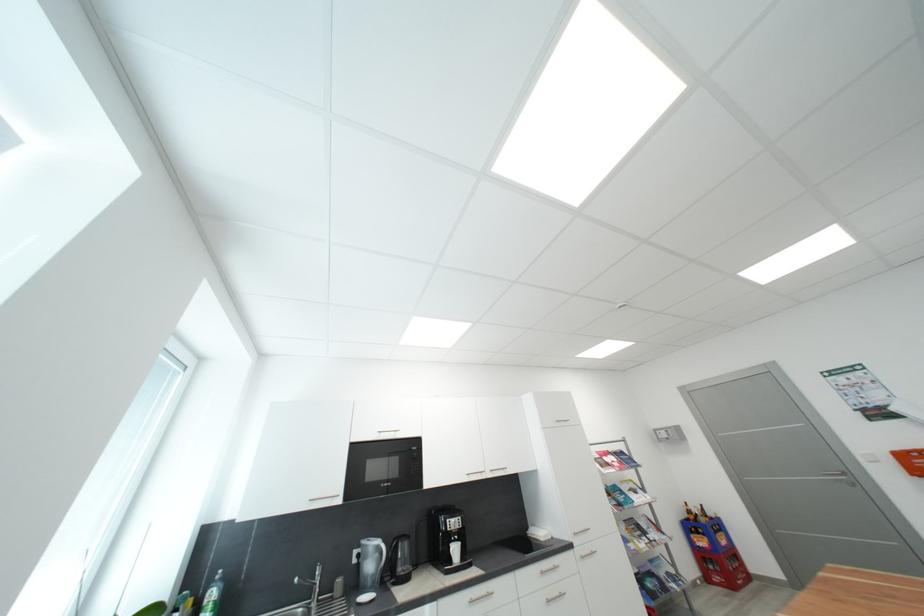
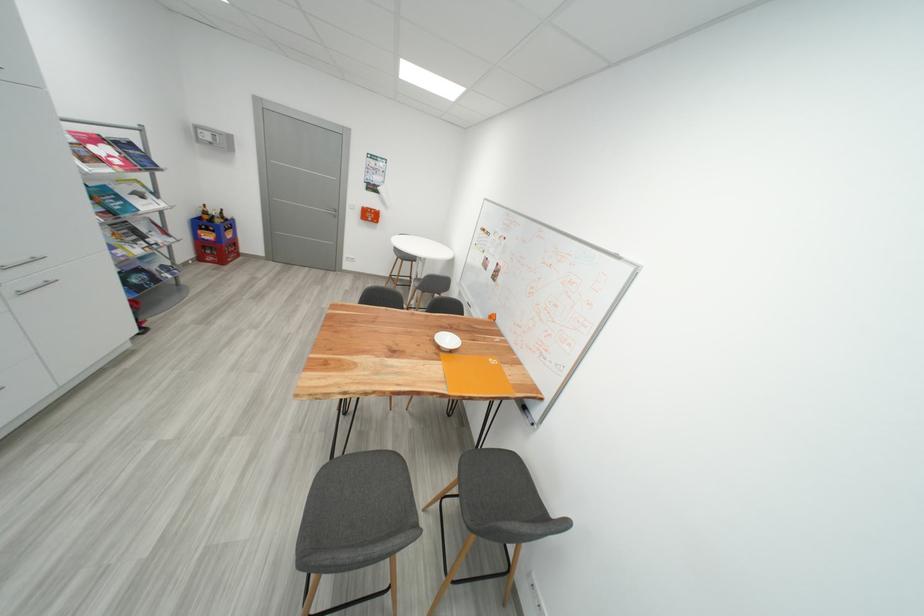
In the second image, find the point that corresponds to (710,522) in the first image.

(225, 223)